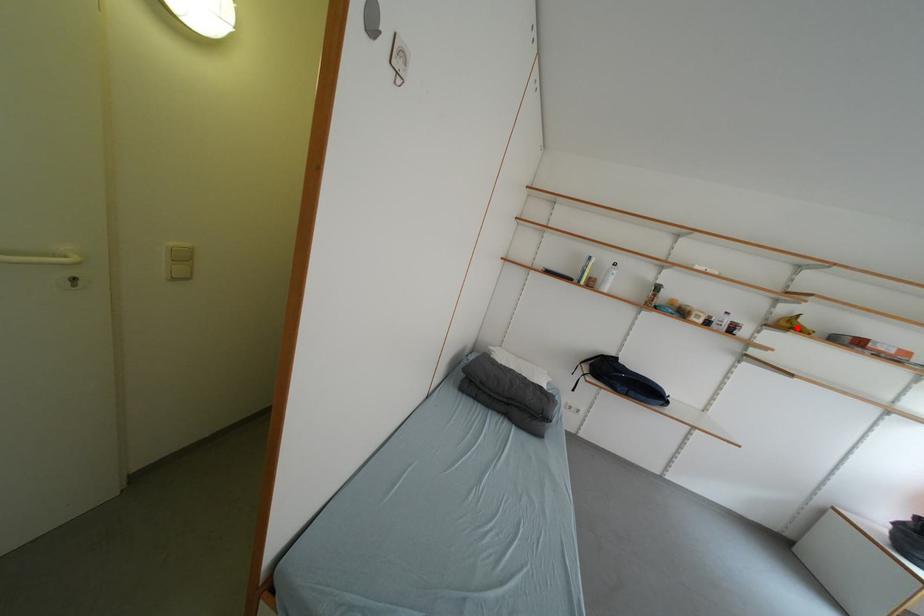
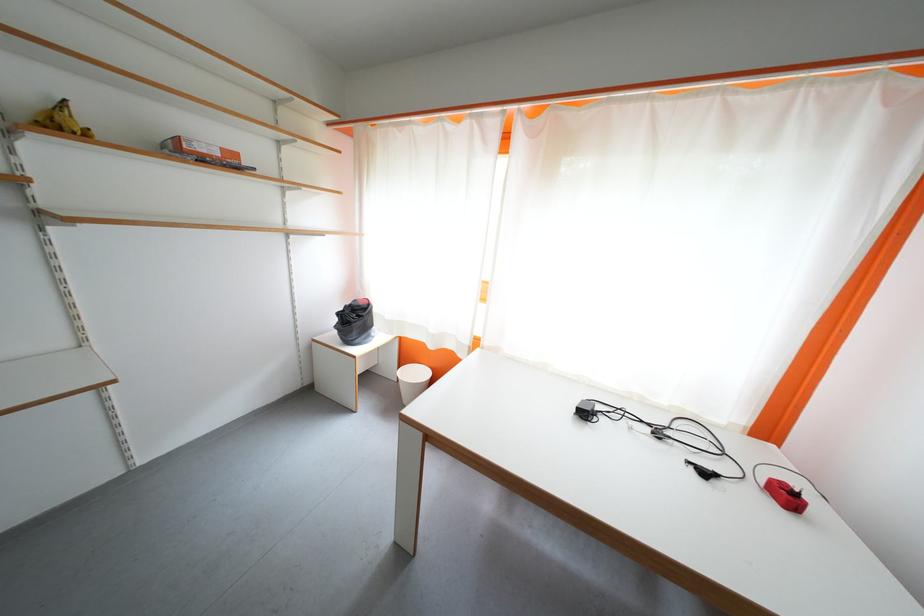
Where in the second image is the point corresponding to the highlighted location from the first image?

(68, 129)